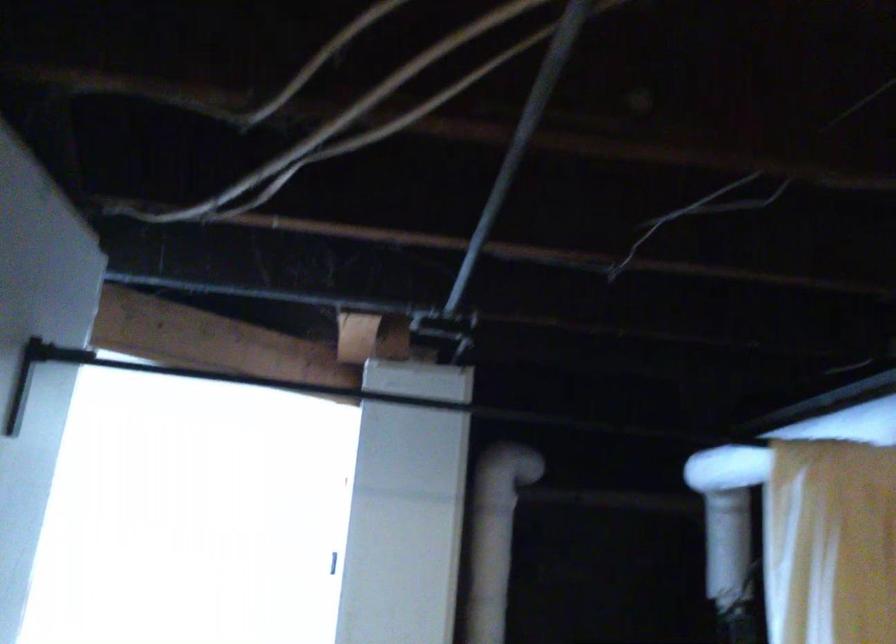
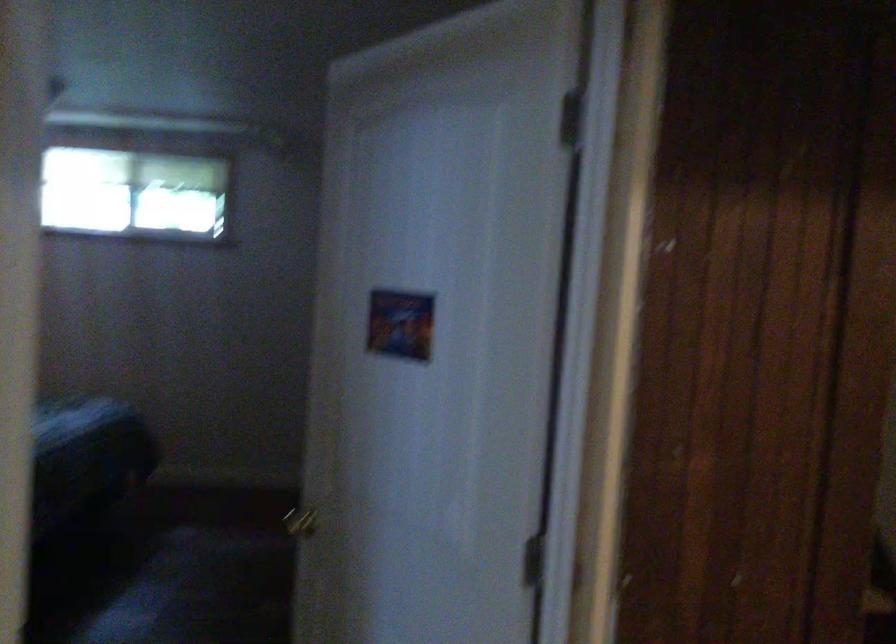
Question: The camera is either moving clockwise (left) or counter-clockwise (right) around the object. The first image is from the beginning of the video and the second image is from the end. Is the camera moving left or right when shooting the video?

Choices:
 (A) Left
 (B) Right

Answer: (A)